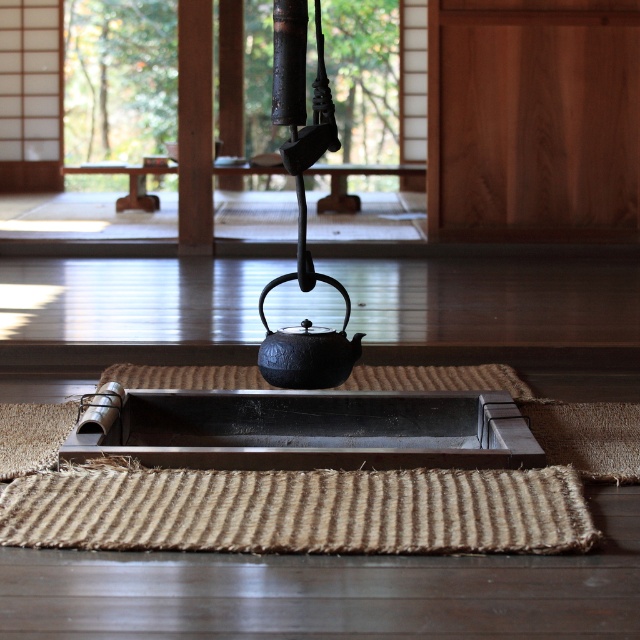
Question: Estimate the real-world distances between objects in this image. Which object is closer to the natural fiber mat at lower center?

Choices:
 (A) sisal rug at center
 (B) shiny dark wood tray at center

Answer: (B)

Question: Can you confirm if natural fiber mat at lower center is bigger than black cast iron teapot at center?

Choices:
 (A) yes
 (B) no

Answer: (A)

Question: Which of the following is the closest to the observer?

Choices:
 (A) (317, 356)
 (B) (296, 467)
 (C) (336, 388)

Answer: (B)

Question: Does natural fiber mat at lower center appear over sisal rug at center?

Choices:
 (A) no
 (B) yes

Answer: (A)

Question: Which object is the farthest from the sisal rug at center?

Choices:
 (A) black cast iron teapot at center
 (B) shiny dark wood tray at center
 (C) natural fiber mat at lower center

Answer: (C)

Question: Considering the relative positions of natural fiber mat at lower center and black cast iron teapot at center in the image provided, where is natural fiber mat at lower center located with respect to black cast iron teapot at center?

Choices:
 (A) left
 (B) right

Answer: (A)